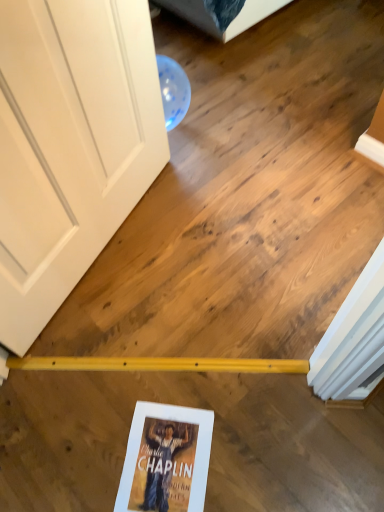
Locate an element on the screen. spots to the right of hardcover book at lower center is located at coordinates (253, 446).